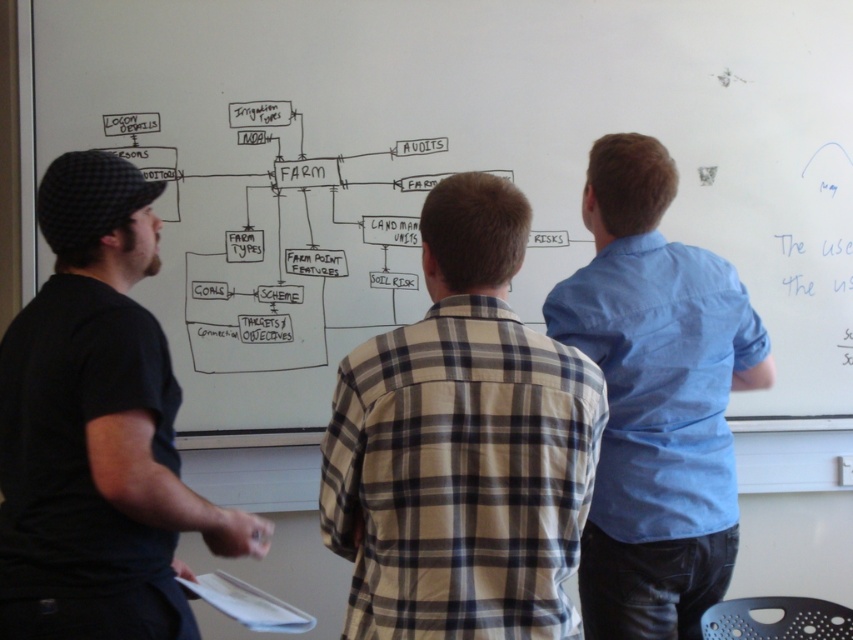
Question: Which point appears farthest from the camera in this image?

Choices:
 (A) (646, 280)
 (B) (583, 154)

Answer: (B)

Question: Among these objects, which one is nearest to the camera?

Choices:
 (A) plaid shirt at center
 (B) light blue shirt at center
 (C) black cotton shirt at left

Answer: (A)

Question: Does plaid shirt at center have a lesser width compared to black cotton shirt at left?

Choices:
 (A) yes
 (B) no

Answer: (B)

Question: Can you confirm if plaid shirt at center is positioned below black cotton shirt at left?

Choices:
 (A) no
 (B) yes

Answer: (B)

Question: Among these points, which one is farthest from the camera?

Choices:
 (A) (50, 595)
 (B) (802, 44)
 (C) (610, 156)
 (D) (462, 262)

Answer: (B)

Question: Is plaid shirt at center to the right of light blue shirt at center from the viewer's perspective?

Choices:
 (A) no
 (B) yes

Answer: (A)